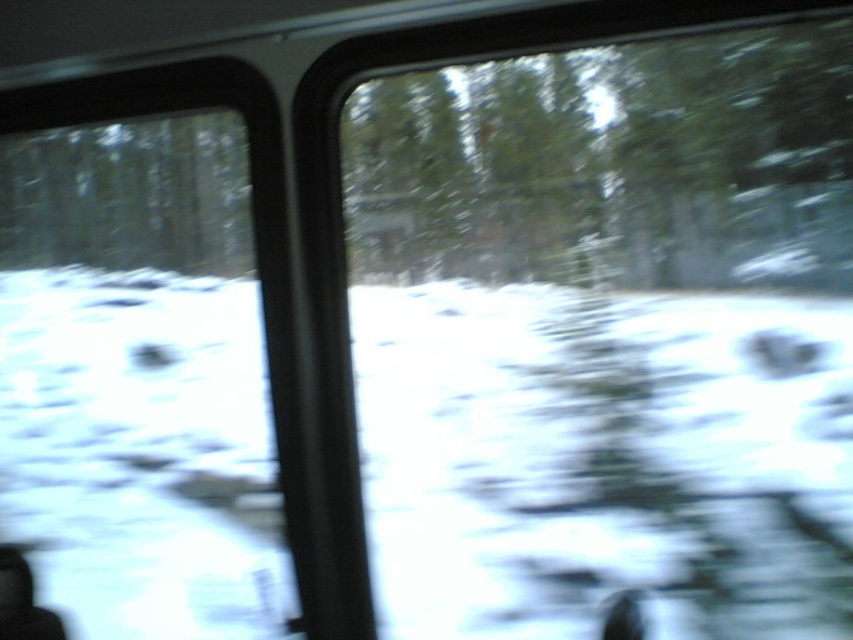
Is green matte tree at upper center wider than green matte tree at upper left?

Correct, the width of green matte tree at upper center exceeds that of green matte tree at upper left.

Locate an element on the screen. The height and width of the screenshot is (640, 853). green matte tree at upper center is located at coordinates (612, 164).